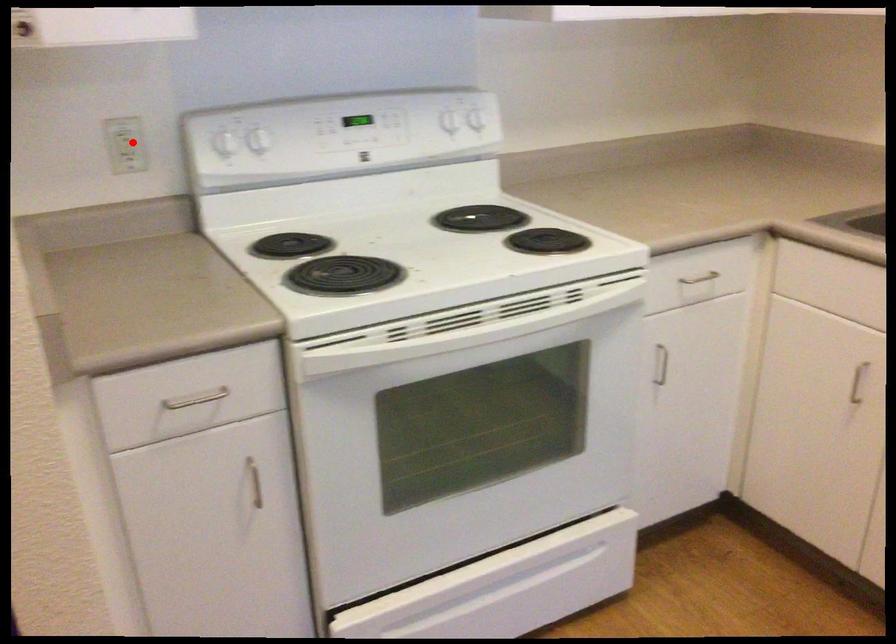
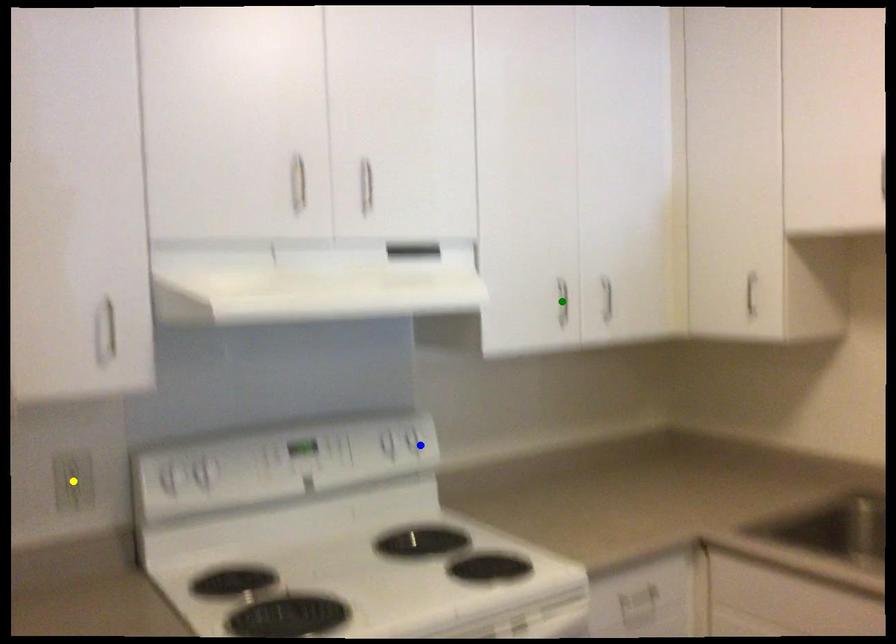
Question: I am providing you with two images of the same scene from different viewpoints. A red point is marked on the first image. You are given multiple points on the second image. In image 2, which mark is for the same physical point as the one in image 1?

Choices:
 (A) blue point
 (B) green point
 (C) yellow point

Answer: (C)